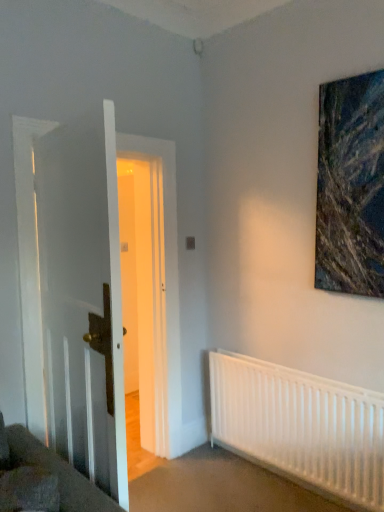
Locate an element on the screen. The width and height of the screenshot is (384, 512). white matte radiator at lower right is located at coordinates (301, 426).

Find the location of a particular element. Image resolution: width=384 pixels, height=512 pixels. white wooden door at left is located at coordinates click(x=83, y=298).

Where is `radiator below the textured canvas painting at upper right (from a real-world perspective)`? This screenshot has width=384, height=512. radiator below the textured canvas painting at upper right (from a real-world perspective) is located at coordinates (301, 426).

Between textured canvas painting at upper right and white matte radiator at lower right, which one has smaller size?

textured canvas painting at upper right is smaller.

Measure the distance between textured canvas painting at upper right and white matte radiator at lower right.

textured canvas painting at upper right and white matte radiator at lower right are 37.95 inches apart from each other.

Does point (115, 175) appear closer or farther from the camera than point (330, 121)?

Point (115, 175) is positioned closer to the camera compared to point (330, 121).

From a real-world perspective, is white wooden door at left beneath textured canvas painting at upper right?

Correct, in the physical world, white wooden door at left is lower than textured canvas painting at upper right.

Is white wooden door at left thinner than textured canvas painting at upper right?

No, white wooden door at left is not thinner than textured canvas painting at upper right.

Is white wooden door at left oriented towards textured canvas painting at upper right?

Yes, white wooden door at left is turned towards textured canvas painting at upper right.

Relative to white wooden door at left, is white matte radiator at lower right in front or behind?

white matte radiator at lower right is positioned farther from the viewer than white wooden door at left.

Considering the relative sizes of white matte radiator at lower right and white wooden door at left in the image provided, is white matte radiator at lower right bigger than white wooden door at left?

No.

Does point (341, 450) come in front of point (75, 176)?

That is False.

Is white matte radiator at lower right positioned with its back to textured canvas painting at upper right?

No, textured canvas painting at upper right is not at the back of white matte radiator at lower right.

Considering the relative positions of white matte radiator at lower right and textured canvas painting at upper right in the image provided, is white matte radiator at lower right to the right of textured canvas painting at upper right from the viewer's perspective?

In fact, white matte radiator at lower right is to the left of textured canvas painting at upper right.

Can you confirm if white matte radiator at lower right is smaller than textured canvas painting at upper right?

No.

From the image's perspective, is white matte radiator at lower right under textured canvas painting at upper right?

Indeed, from the image's perspective, white matte radiator at lower right is shown beneath textured canvas painting at upper right.

Which object is closer to the camera, textured canvas painting at upper right or white wooden door at left?

white wooden door at left is more forward.

I want to click on picture frame above the white wooden door at left (from a real-world perspective), so click(x=351, y=186).

Is textured canvas painting at upper right thinner than white wooden door at left?

Indeed, textured canvas painting at upper right has a lesser width compared to white wooden door at left.

Between textured canvas painting at upper right and white wooden door at left, which one has smaller size?

textured canvas painting at upper right is smaller.

Considering the sizes of white wooden door at left and white matte radiator at lower right in the image, is white wooden door at left wider or thinner than white matte radiator at lower right?

Clearly, white wooden door at left has more width compared to white matte radiator at lower right.

From a real-world perspective, who is located higher, white wooden door at left or white matte radiator at lower right?

white wooden door at left.

In the scene shown: Can you confirm if white wooden door at left is taller than white matte radiator at lower right?

Correct, white wooden door at left is much taller as white matte radiator at lower right.

From the image's perspective, is white wooden door at left above or below white matte radiator at lower right?

From the image's perspective, white wooden door at left appears above white matte radiator at lower right.

You are a GUI agent. You are given a task and a screenshot of the screen. Output one action in this format:
    pyautogui.click(x=<x>, y=<y>)
    Task: Click on the picture frame lying above the white matte radiator at lower right (from the image's perspective)
    
    Given the screenshot: What is the action you would take?
    pyautogui.click(x=351, y=186)

Locate an element on the screen. picture frame that appears on the right of white wooden door at left is located at coordinates (351, 186).

From the picture: Estimate the real-world distances between objects in this image. Which object is closer to white wooden door at left, textured canvas painting at upper right or white matte radiator at lower right?

white matte radiator at lower right lies closer to white wooden door at left than the other object.

Estimate the real-world distances between objects in this image. Which object is further from white matte radiator at lower right, textured canvas painting at upper right or white wooden door at left?

Based on the image, white wooden door at left appears to be further to white matte radiator at lower right.

Based on their spatial positions, is white matte radiator at lower right or textured canvas painting at upper right closer to white wooden door at left?

white matte radiator at lower right is closer to white wooden door at left.

When comparing their distances from textured canvas painting at upper right, does white matte radiator at lower right or white wooden door at left seem closer?

Among the two, white matte radiator at lower right is located nearer to textured canvas painting at upper right.

Based on the photo, which object lies nearer to the anchor point white matte radiator at lower right, white wooden door at left or textured canvas painting at upper right?

textured canvas painting at upper right is positioned closer to the anchor white matte radiator at lower right.

Which object lies nearer to the anchor point textured canvas painting at upper right, white wooden door at left or white matte radiator at lower right?

white matte radiator at lower right.

I want to click on radiator between white wooden door at left and textured canvas painting at upper right in the horizontal direction, so click(x=301, y=426).